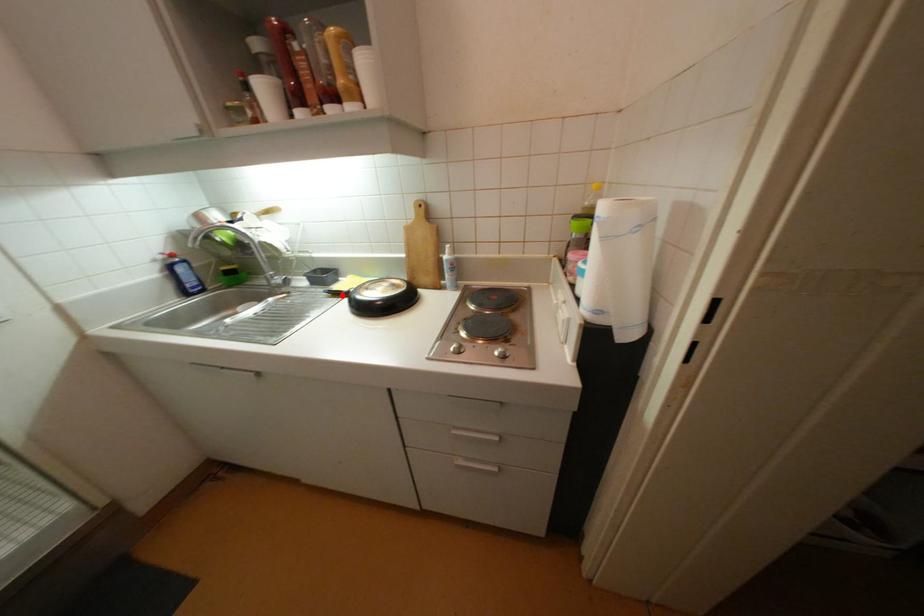
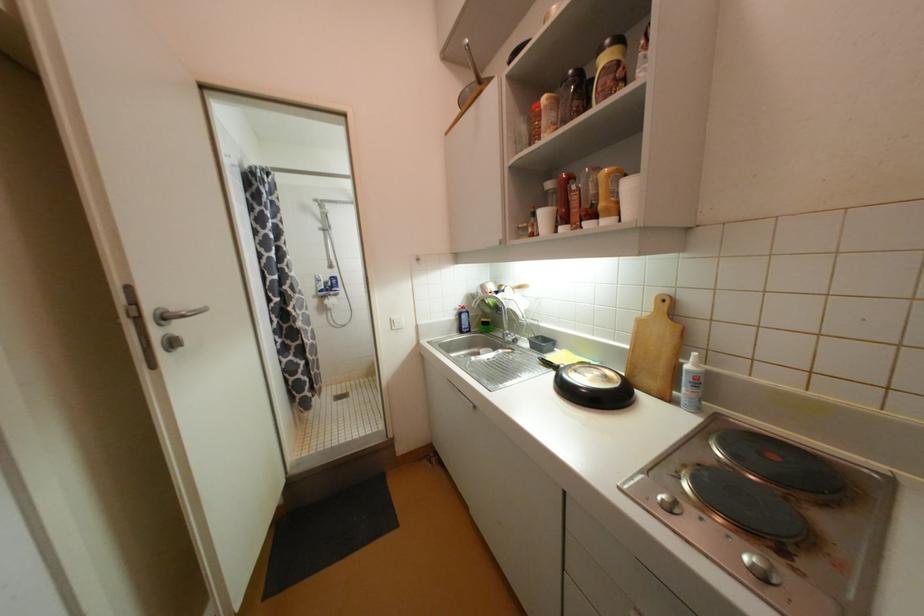
Locate, in the second image, the point that corresponds to the highlighted location in the first image.

(553, 365)